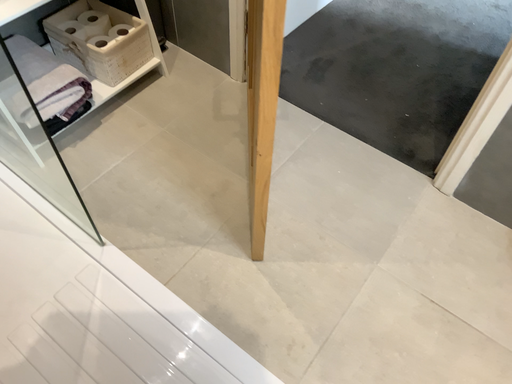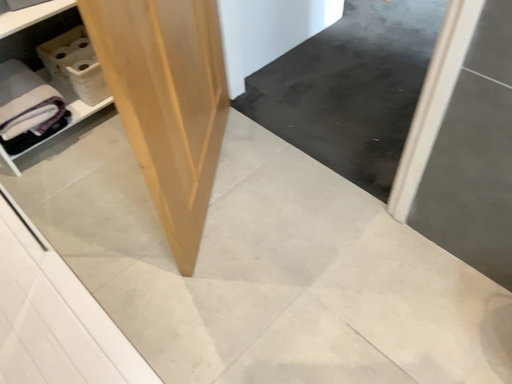
Question: Which way did the camera rotate in the video?

Choices:
 (A) rotated right
 (B) rotated left

Answer: (B)